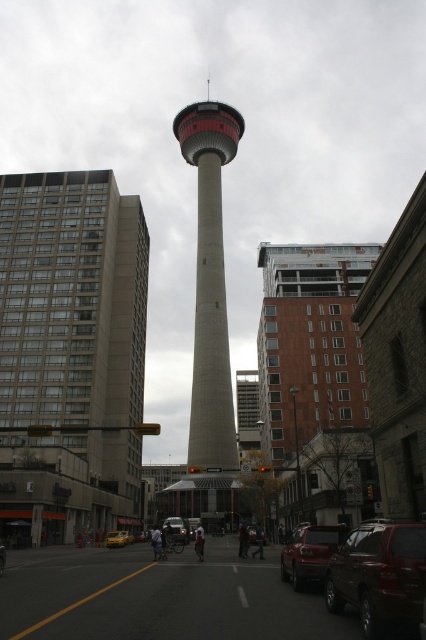
Between concrete building at left and shiny black car at center, which one is positioned lower?

shiny black car at center is below.

Which is in front, point (92, 529) or point (186, 536)?

Point (186, 536) is more forward.

Find the location of `concrete building at left`. concrete building at left is located at coordinates (71, 353).

You are a GUI agent. You are given a task and a screenshot of the screen. Output one action in this format:
    pyautogui.click(x=<x>, y=<y>)
    Task: Click on the matte red suv at center
    
    Given the screenshot: What is the action you would take?
    pyautogui.click(x=308, y=554)

Is point (279, 568) closer to camera compared to point (124, 538)?

Yes, it is.

This screenshot has width=426, height=640. Identify the location of matte red suv at center. (308, 554).

Can you confirm if concrete building at left is positioned below yellow matte car at center?

Actually, concrete building at left is above yellow matte car at center.

Does point (103, 280) come in front of point (121, 538)?

No, it is behind (121, 538).

Between point (11, 276) and point (123, 541), which one is positioned behind?

The point (11, 276) is more distant.

Locate an element on the screen. The image size is (426, 640). concrete building at left is located at coordinates pos(71,353).